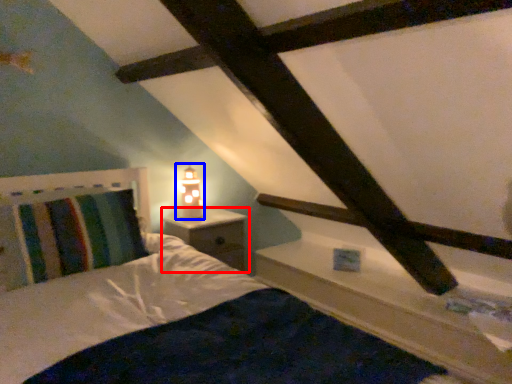
Question: Which object is further to the camera taking this photo, nightstand (highlighted by a red box) or table lamp (highlighted by a blue box)?

Choices:
 (A) nightstand
 (B) table lamp

Answer: (B)